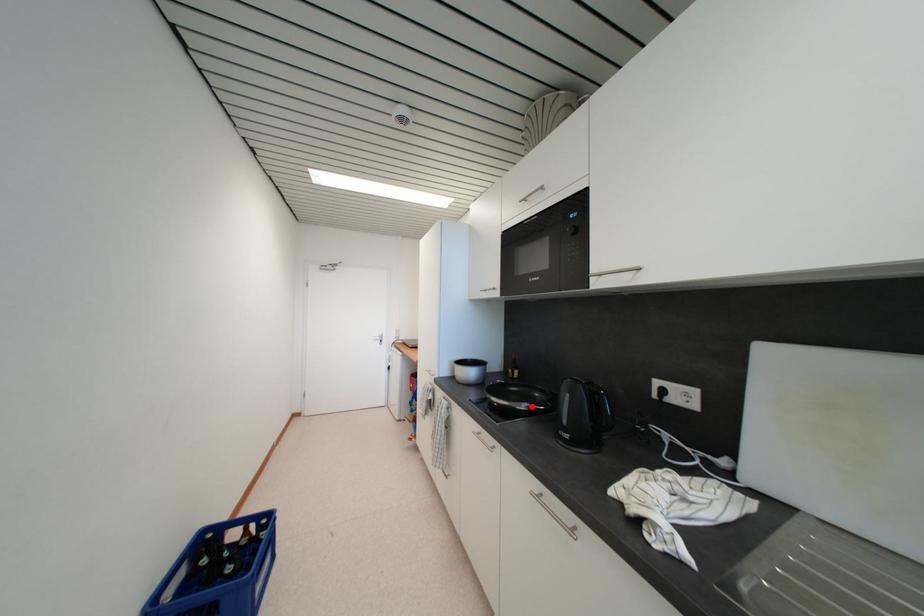
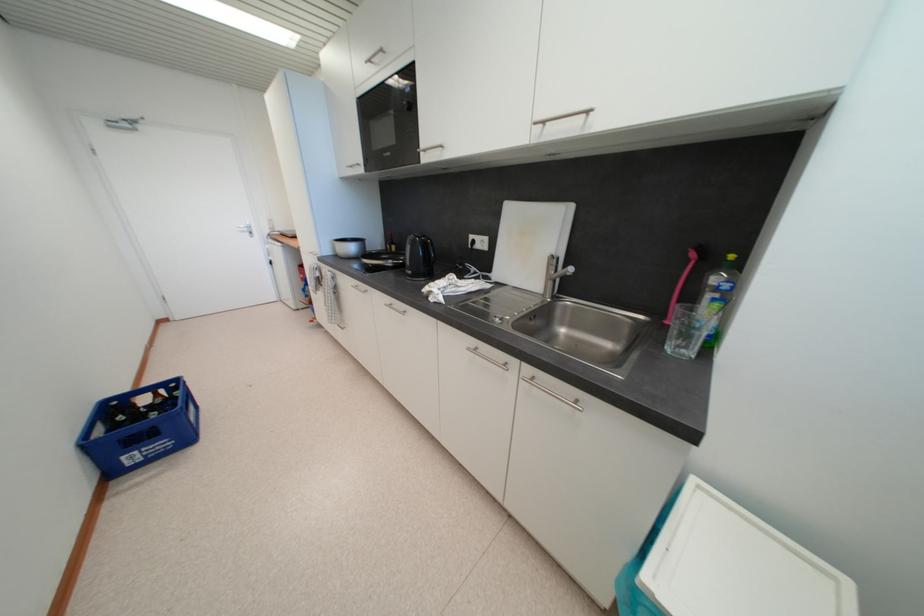
Locate, in the second image, the point that corresponds to the highlighted location in the first image.

(395, 264)